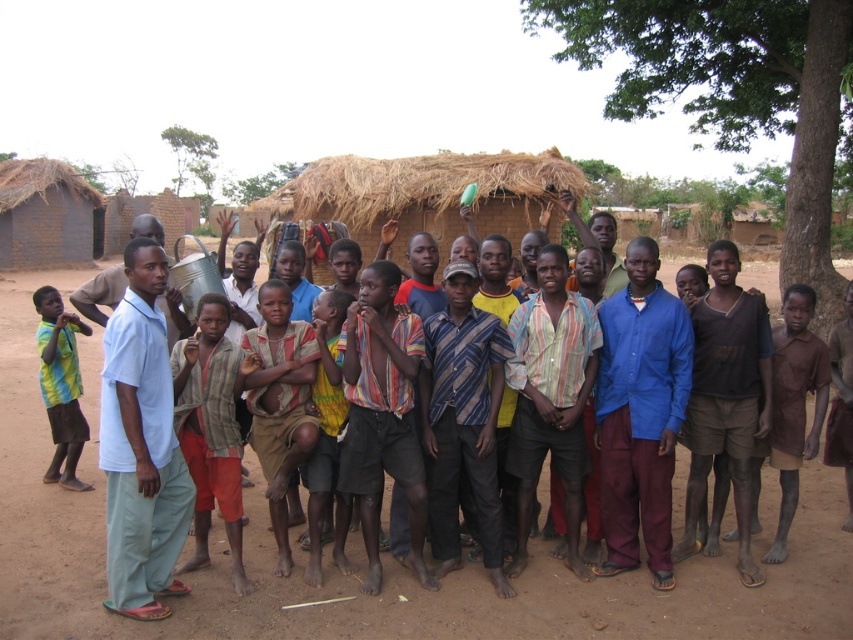
Question: Which object appears closest to the camera in this image?

Choices:
 (A) brown dirt field at center
 (B) light blue cotton shirt at center
 (C) green leafy tree at upper left
 (D) brown cotton shirt at center

Answer: (B)

Question: Is light blue cotton shirt at center below striped fabric shirt at center?

Choices:
 (A) no
 (B) yes

Answer: (A)

Question: Is light blue cotton shirt at center wider than green leafy tree at upper left?

Choices:
 (A) no
 (B) yes

Answer: (A)

Question: Which is farther from the light blue cotton shirt at center?

Choices:
 (A) green leafy tree at right
 (B) brown dirt field at center
 (C) yellow-green striped shirt at left

Answer: (A)

Question: Which object is farther from the camera taking this photo?

Choices:
 (A) green leafy tree at right
 (B) light blue cotton shirt at center

Answer: (A)

Question: Can you confirm if light blue cotton shirt at center is positioned below green leafy tree at upper left?

Choices:
 (A) yes
 (B) no

Answer: (A)